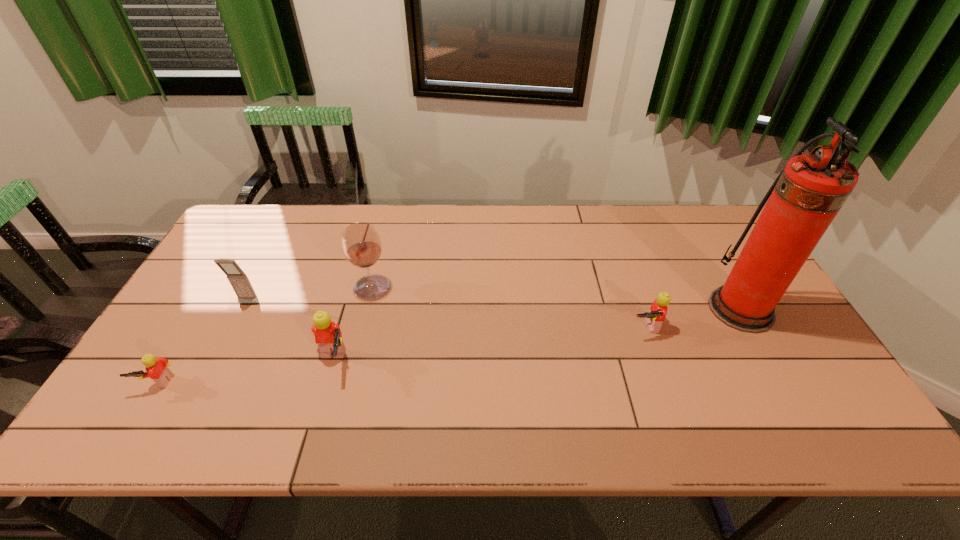
Image resolution: width=960 pixels, height=540 pixels. I want to click on free space that satisfies the following two spatial constraints: 1. on the front side of the wineglass; 2. in front of the second Lego from left to right with the accessory visible, so click(x=353, y=362).

This screenshot has width=960, height=540. What are the coordinates of `free point that satisfies the following two spatial constraints: 1. in front of the tallest Lego with the accessory visible; 2. in front of the leftmost Lego with the accessory visible` in the screenshot? It's located at (326, 382).

Identify the location of free location that satisfies the following two spatial constraints: 1. at the discharge end of the fire extinguisher; 2. in front of the rightmost Lego with the accessory visible. The image size is (960, 540). (x=751, y=327).